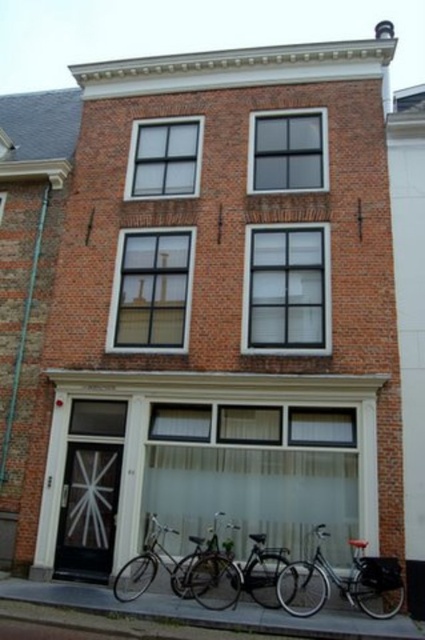
You are standing in front of the traditional brick building and want to determine the relative positions of two points marked on the building. The first point is at coordinates point (47, 497) and the second is at point (390, 595). Which point is closer to you?

Point (47, 497) is closer to you because it is further to the viewer than point (390, 595).